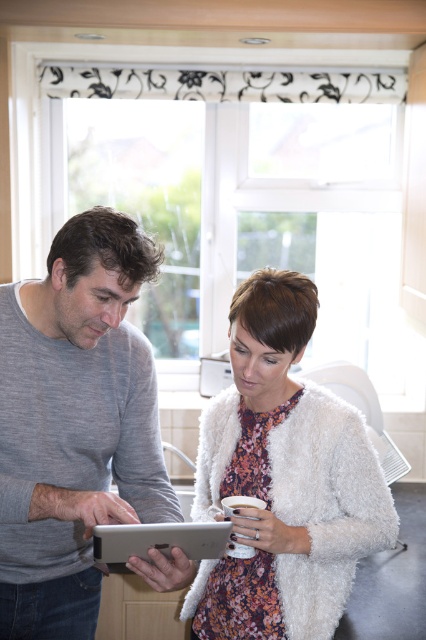
Looking at this image, you are an interior designer who needs to ensure that the gray matte shirt at left and the silver metallic tablet at center can both fit on a 1.2 meter wide shelf. Based on their sizes, will they both fit?

The gray matte shirt at left is larger in size than the silver metallic tablet at center. However, without specific measurements of their individual widths, it is impossible to determine if both will fit on the 1.2 meter wide shelf. Additional information about their dimensions is required.

Looking at this image, you are trying to decide which item to take with you for a cold day. Both the white fluffy jacket at center and the white fluffy cardigan at center are available. Based on their sizes, which one would provide more warmth?

The white fluffy jacket at center is larger in size than the white fluffy cardigan at center, so it would provide more warmth.

You are standing in the room and want to hand the silver metallic tablet at center to the person wearing the gray matte shirt at left. Can you directly hand it to them without moving either the tablet or the shirt?

The gray matte shirt at left is positioned on the left side of the silver metallic tablet at center, so yes, you can directly hand the silver metallic tablet at center to the person wearing the gray matte shirt at left by moving it to their side since they are already positioned next to each other.